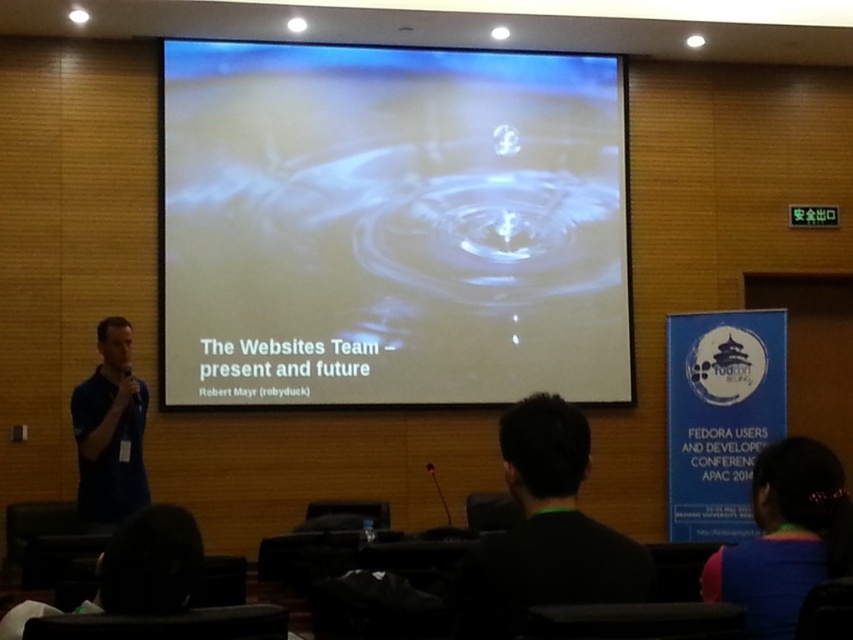
The width and height of the screenshot is (853, 640). I want to click on transparent liquid droplets at center, so click(392, 227).

Measure the distance from black matte shirt at center to rainbow fabric shirt at lower right.

A distance of 53.96 centimeters exists between black matte shirt at center and rainbow fabric shirt at lower right.

Who is positioned more to the left, black matte shirt at center or rainbow fabric shirt at lower right?

black matte shirt at center is more to the left.

Image resolution: width=853 pixels, height=640 pixels. What are the coordinates of `black matte shirt at center` in the screenshot? It's located at (544, 531).

Is point (465, 273) farther from viewer compared to point (828, 515)?

That is True.

Is transparent liquid droplets at center shorter than rainbow fabric shirt at lower right?

No.

Where is `transparent liquid droplets at center`? transparent liquid droplets at center is located at coordinates (392, 227).